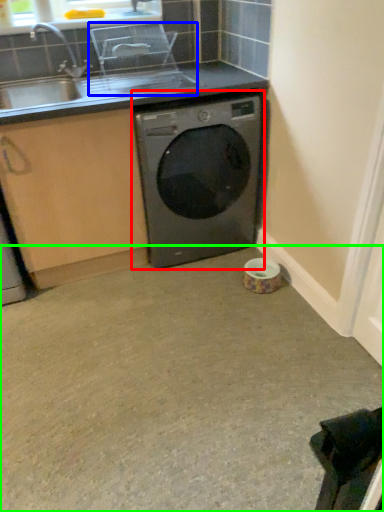
Question: Which is nearer to the washing machine (highlighted by a red box)? appliance (highlighted by a blue box) or concrete (highlighted by a green box).

Choices:
 (A) appliance
 (B) concrete

Answer: (A)